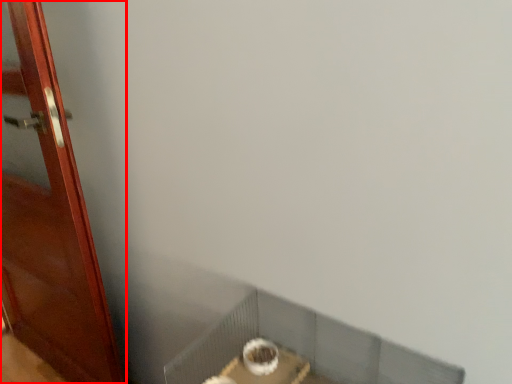
Question: From the image's perspective, considering the relative positions of door (annotated by the red box) and window sill in the image provided, where is door (annotated by the red box) located with respect to the staircase?

Choices:
 (A) above
 (B) below

Answer: (A)